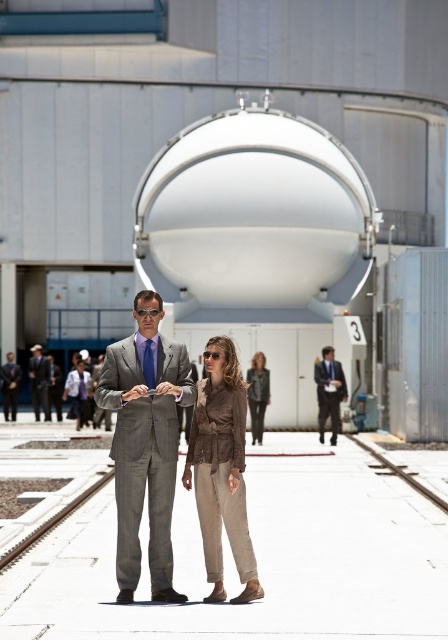
Question: Which point is closer to the camera?

Choices:
 (A) (218, 429)
 (B) (417, 483)

Answer: (A)

Question: Which of these objects is positioned farthest from the brown leather jacket at center?

Choices:
 (A) gray metallic train track at lower left
 (B) leather jacket at center
 (C) gray metallic train track at lower center
 (D) gray suit at center

Answer: (D)

Question: Is brown leather jacket at center closer to camera compared to gray metallic train track at lower center?

Choices:
 (A) yes
 (B) no

Answer: (A)

Question: Considering the relative positions of dark blue suit at center and gray metallic train track at lower left in the image provided, where is dark blue suit at center located with respect to gray metallic train track at lower left?

Choices:
 (A) right
 (B) left

Answer: (A)

Question: Considering the real-world distances, which object is closest to the gray metallic train track at lower center?

Choices:
 (A) gray suit at center
 (B) matte gray suit at center
 (C) dark blue suit at center

Answer: (C)

Question: Is gray metallic train track at lower left above gray suit at center?

Choices:
 (A) yes
 (B) no

Answer: (B)